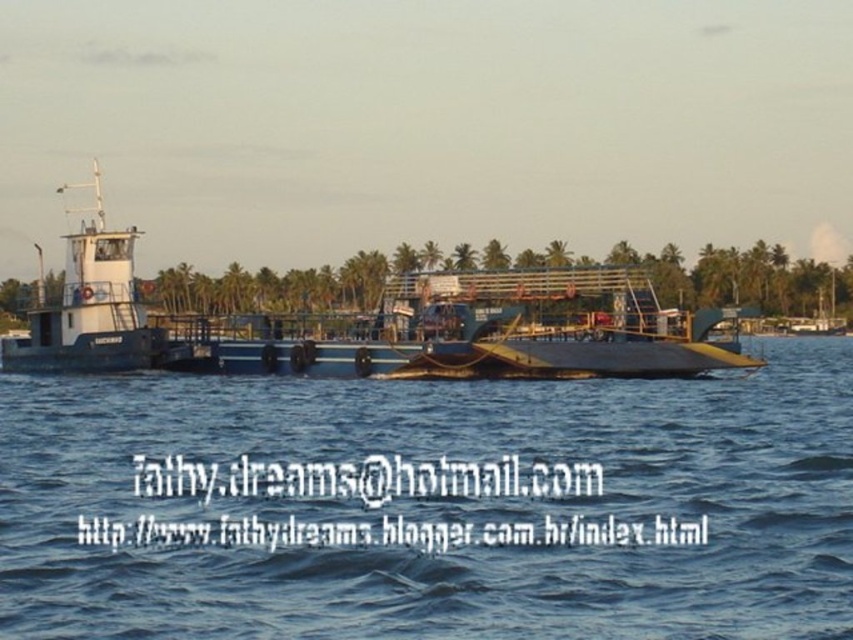
Is point (346, 595) farther from camera compared to point (146, 333)?

No, (346, 595) is closer to viewer.

Between blue water at center and blue matte ferryboat at center, which one is positioned higher?

blue matte ferryboat at center is above.

Measure the distance between blue water at center and camera.

blue water at center and camera are 63.22 feet apart from each other.

The height and width of the screenshot is (640, 853). What are the coordinates of `blue water at center` in the screenshot? It's located at (442, 506).